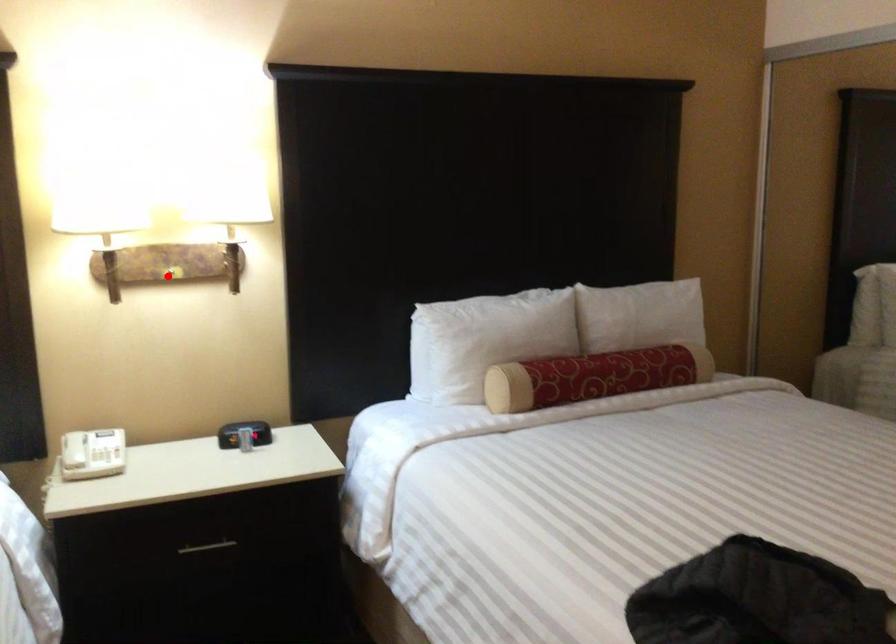
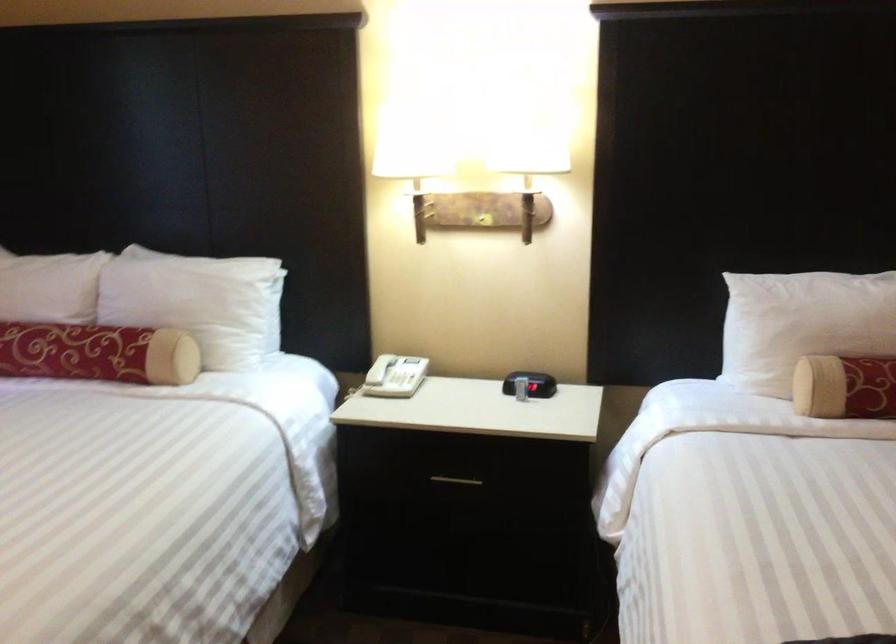
The point at the highlighted location is marked in the first image. Where is the corresponding point in the second image?

(483, 220)